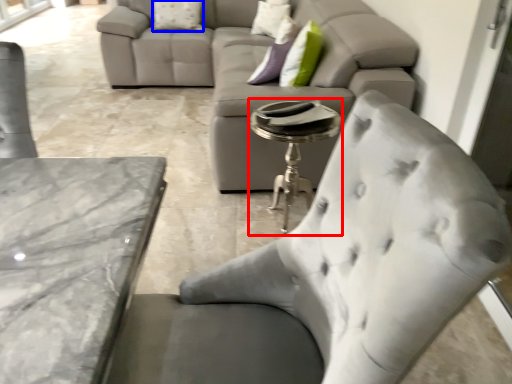
Question: Which object is further to the camera taking this photo, side table (highlighted by a red box) or pillow (highlighted by a blue box)?

Choices:
 (A) side table
 (B) pillow

Answer: (B)